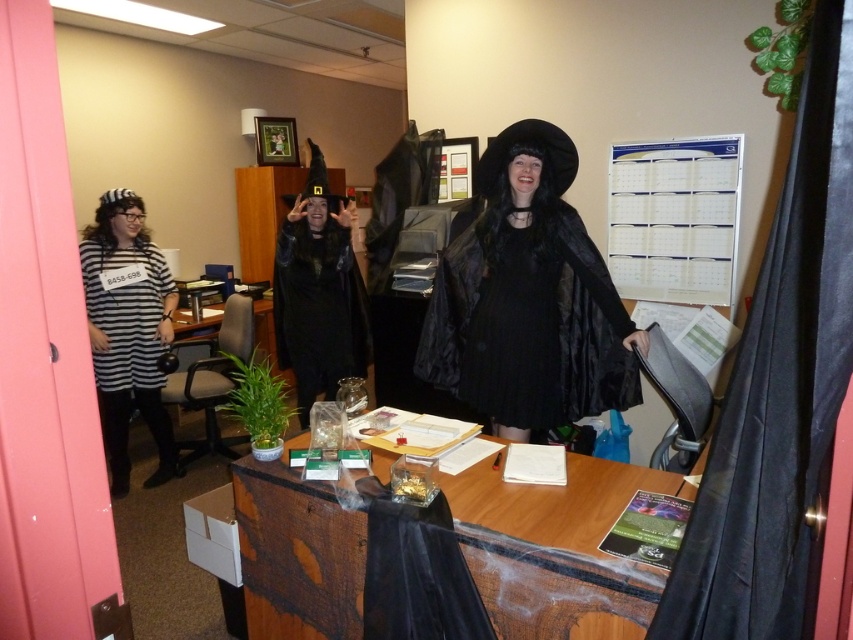
You are organizing a Halloween party in the office and need to place decorations on the wooden table at center and the striped fabric shirt at left. Which surface can accommodate larger decorations?

The wooden table at center can accommodate larger decorations because it is bigger than the striped fabric shirt at left.

You are an office worker trying to reach the striped fabric shirt at left on the desk. However, there is a wooden table at center blocking your path. Can you move around the table to access the shirt without moving any items on the desk?

The wooden table at center is closer to the viewer than the striped fabric shirt at left, so you can move around the table to access the striped fabric shirt at left since it is behind the table and not directly in front of it.